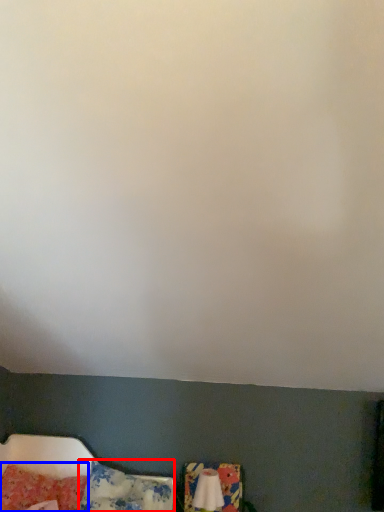
Question: Which of the following is the closest to the observer, pillow (highlighted by a red box) or pillow (highlighted by a blue box)?

Choices:
 (A) pillow
 (B) pillow

Answer: (A)